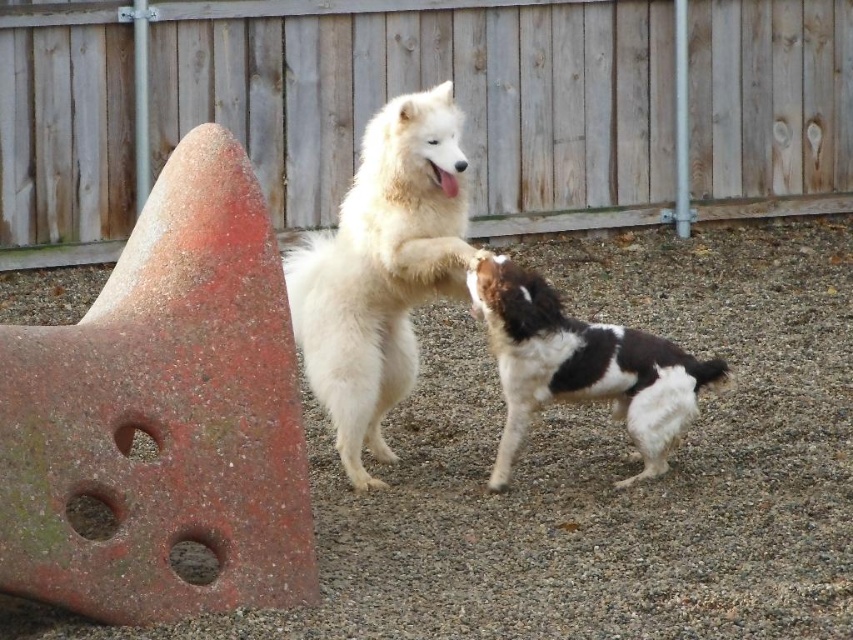
What do you see at coordinates (381, 269) in the screenshot?
I see `white fluffy dog at center` at bounding box center [381, 269].

Does white fluffy dog at center appear under black and white fur dog at center?

Incorrect, white fluffy dog at center is not positioned below black and white fur dog at center.

Locate an element on the screen. This screenshot has width=853, height=640. white fluffy dog at center is located at coordinates (381, 269).

How distant is wooden fence at upper center from white fluffy dog at center?

A distance of 2.97 meters exists between wooden fence at upper center and white fluffy dog at center.

Between point (80, 218) and point (431, 259), which one is positioned in front?

Point (431, 259) is more forward.

At what (x,y) coordinates should I click in order to perform the action: click on wooden fence at upper center. Please return your answer as a coordinate pair (x, y). Looking at the image, I should click on (425, 86).

Does wooden fence at upper center have a lesser width compared to black and white fur dog at center?

In fact, wooden fence at upper center might be wider than black and white fur dog at center.

Who is positioned more to the left, wooden fence at upper center or black and white fur dog at center?

Positioned to the left is wooden fence at upper center.

I want to click on wooden fence at upper center, so click(x=425, y=86).